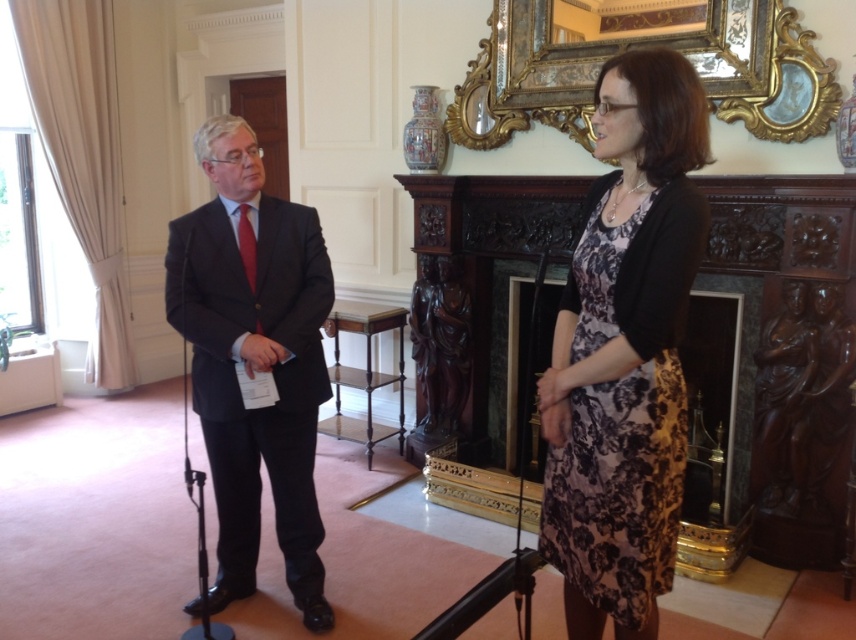
You are a photographer at the event and need to capture a clear shot of the dark gray suit at left without the gold ornate picture frame at upper center blocking it. Is this possible based on their positions?

The dark gray suit at left is in front of the gold ornate picture frame at upper center, so it will block the view of the frame. To capture the frame clearly without obstruction, you would need to reposition or adjust the angle to exclude the suit from the frame.

You are standing in the room and want to move from the point at coordinates point (604, 428) to the point at coordinates point (198, 403). Which direction should you move to reach your destination?

To move from point (604, 428) to point (198, 403), you should move downward because point (198, 403) is behind point (604, 428).